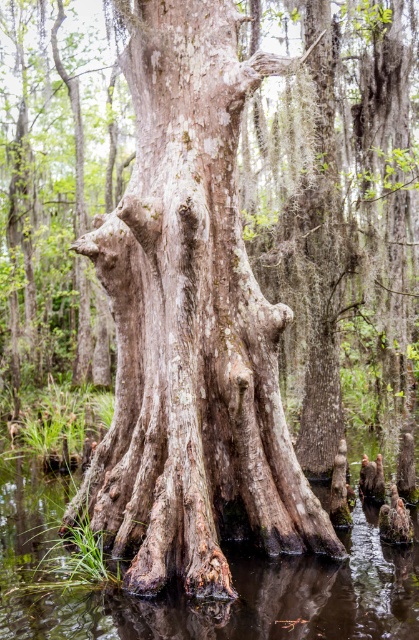
You are a kayaker navigating through the swamp and want to avoid hitting the tree trunk. Which object should you steer away from first, the smooth bark tree trunk at center or the brown muddy water at lower center?

You should steer away from the smooth bark tree trunk at center first because it is closer to you than the brown muddy water at lower center, which is further away.

You are a researcher studying the swamp ecosystem. You have a drone equipped with a camera that can capture high resolution images of the swamp. The drone is currently positioned at the point marked as point (x=191, y=324). Your goal is to capture an image of the smooth bark tree trunk at center. Is the drone positioned correctly to capture the tree trunk in the image?

The smooth bark tree trunk at center is located at point (x=191, y=324), so yes, the drone is positioned correctly to capture the tree trunk in the image.

You are navigating a small boat through the swamp and need to avoid obstacles. There is a smooth bark tree trunk at center in your path. Based on its position, can you determine if it is directly ahead or to the side of your boat?

The smooth bark tree trunk at center is located at point coordinates, so it is directly ahead of the boat.